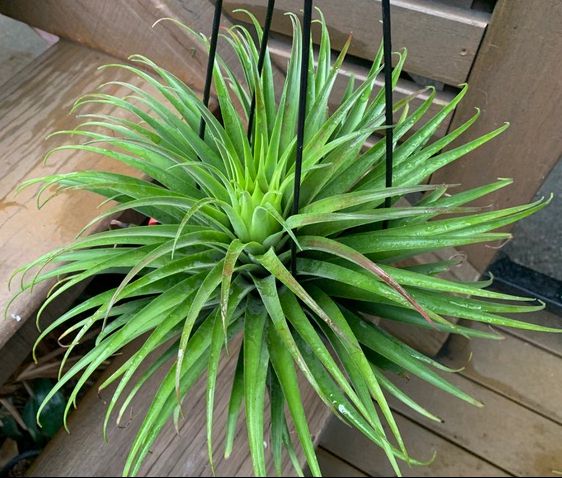
The image size is (562, 478). Identify the location of wall. (471, 70).